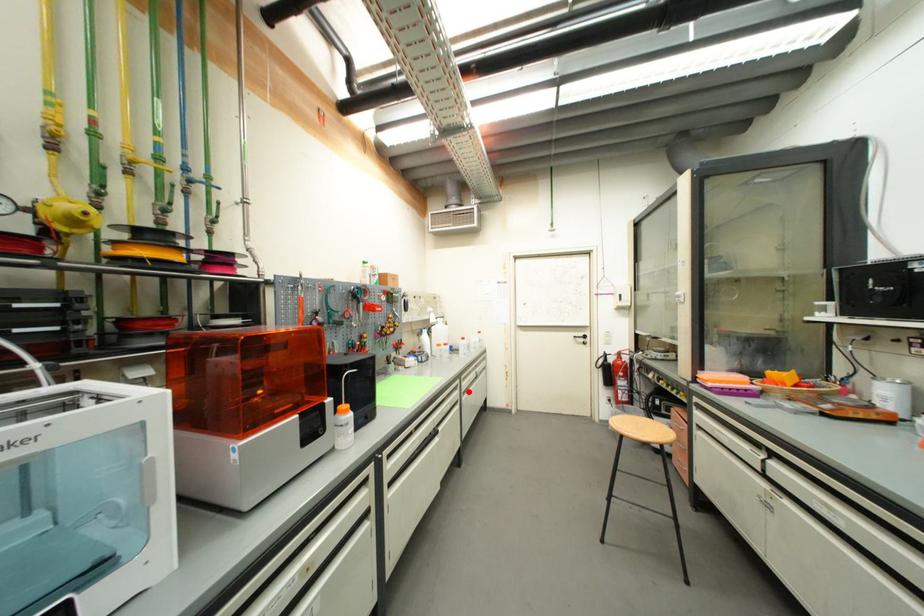
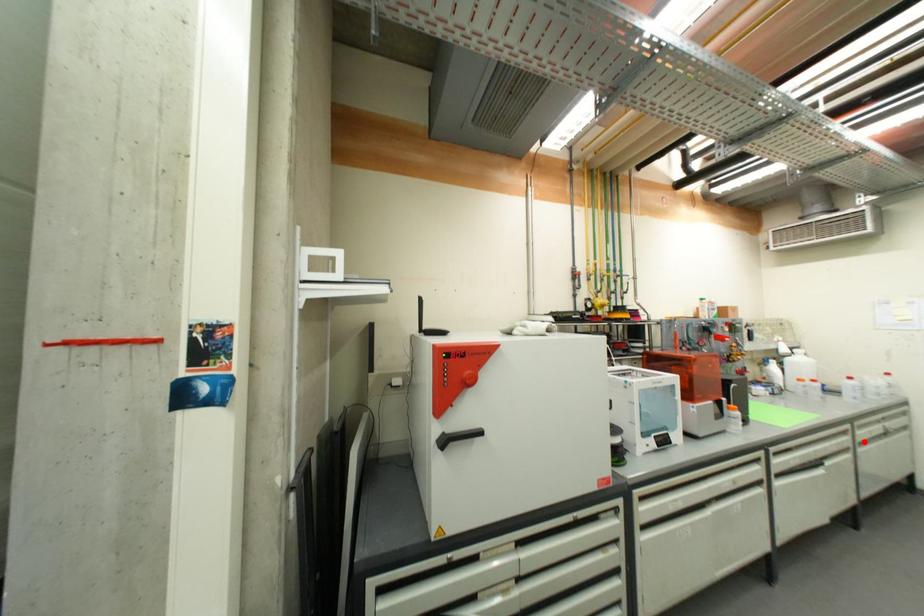
I am providing you with two images of the same scene from different viewpoints. A red point is marked on the first image and another point is marked on the second image. Is the red point in image1 aligned with the point shown in image2?

Yes